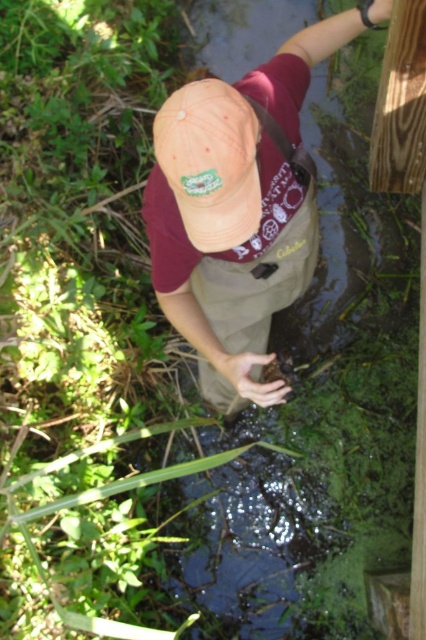
Is tan canvas hat at upper center positioned behind khaki fabric at center?

No, it is in front of khaki fabric at center.

Is tan canvas hat at upper center thinner than khaki fabric at center?

No, tan canvas hat at upper center is not thinner than khaki fabric at center.

The width and height of the screenshot is (426, 640). What do you see at coordinates (238, 209) in the screenshot? I see `tan canvas hat at upper center` at bounding box center [238, 209].

This screenshot has width=426, height=640. What are the coordinates of `tan canvas hat at upper center` in the screenshot? It's located at (238, 209).

Does point (250, 118) lie behind point (252, 376)?

No, (250, 118) is in front of (252, 376).

Is point (187, 168) positioned after point (290, 259)?

No, it is in front of (290, 259).

Locate an element on the screen. matte orange cap at center is located at coordinates (210, 163).

Identify the location of tan canvas hat at upper center. The height and width of the screenshot is (640, 426). (238, 209).

Who is more distant from viewer, (x=253, y=179) or (x=207, y=182)?

Point (x=253, y=179)

At what (x,y) coordinates should I click in order to perform the action: click on tan canvas hat at upper center. Please return your answer as a coordinate pair (x, y). Looking at the image, I should click on (238, 209).